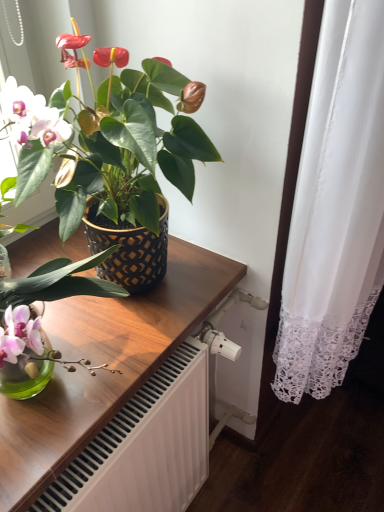
Image resolution: width=384 pixels, height=512 pixels. Identify the location of free point above wooden table at center (from a real-world perspective). (109, 328).